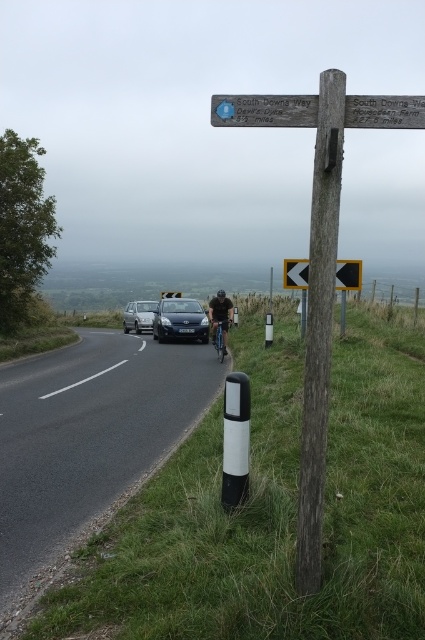
You are standing on the rural road and want to read the information on the wooden signpost at upper center. Can you read it clearly without moving closer?

The wooden signpost at upper center is 2.88 meters away from you, so yes, you can read it clearly without moving closer.

Based on the photo, you are a pedestrian standing at the edge of the road and see the yellow plastic arrow at center and the blue metallic bicycle at center. Which object is nearer to you?

The yellow plastic arrow at center is closer to the viewer than the blue metallic bicycle at center.

You are a pedestrian standing at the edge of the road. You see a silver metallic car at center and a blue metallic bicycle at center. Which one is larger in size?

The silver metallic car at center is bigger than the blue metallic bicycle at center.